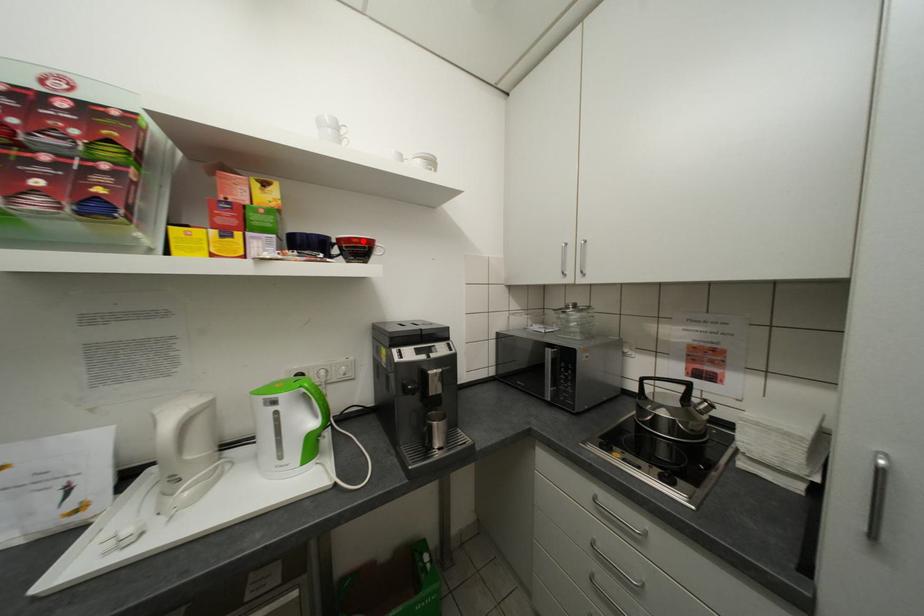
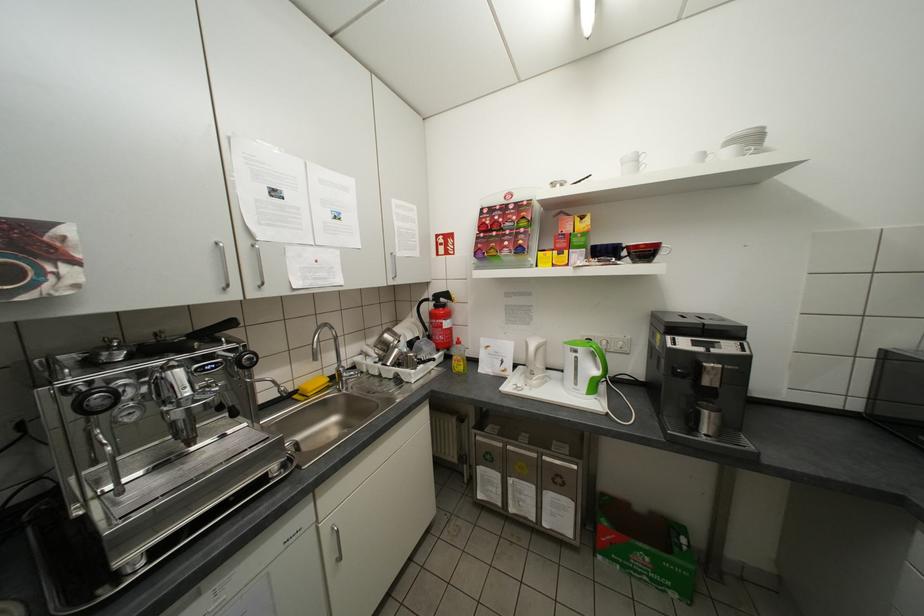
Locate, in the second image, the point that corresponds to the highlighted location in the first image.

(650, 246)